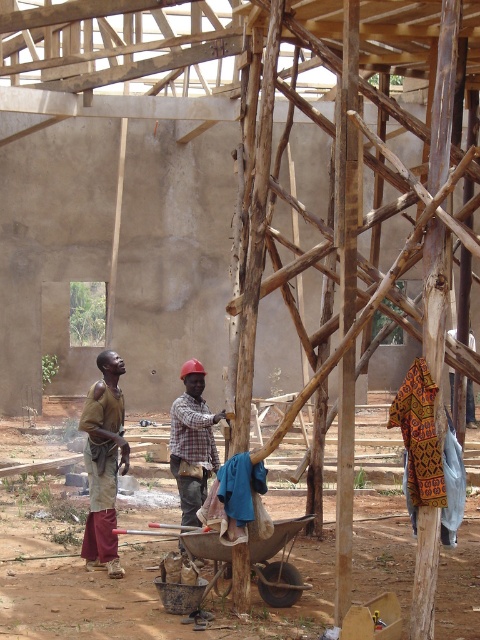
You are standing at the construction site and want to move from the point closer to you to the point further away. Which path should you take between the two points, point (109, 488) and point (189, 481)?

You should move from point (109, 488) to point (189, 481) because point (109, 488) is closer to the viewer and you need to go to the point further away.

You are an observer standing at the edge of the construction site. You notice two fabrics in the scene. The first is the brown fabric at left, and the second is the plaid fabric shirt at center. Which of these fabrics is taller?

The brown fabric at left is taller than the plaid fabric shirt at center.